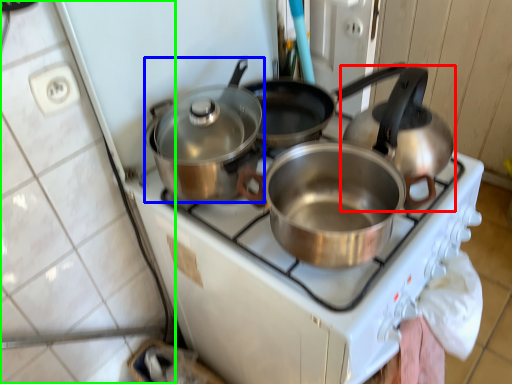
Question: Which is nearer to the kettle (highlighted by a red box)? kitchen appliance (highlighted by a blue box) or tile (highlighted by a green box).

Choices:
 (A) kitchen appliance
 (B) tile

Answer: (A)